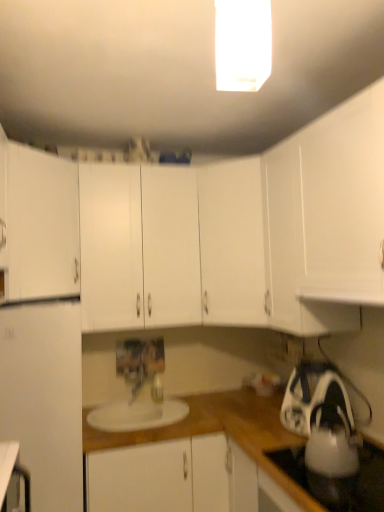
Question: From a real-world perspective, is white matte cabinet at center, the second cabinetry positioned from the bottom, beneath white glossy rectangular light fixture at upper center?

Choices:
 (A) yes
 (B) no

Answer: (A)

Question: From the image's perspective, is white matte cabinet at center, the third cabinetry viewed from the top, under white glossy rectangular light fixture at upper center?

Choices:
 (A) yes
 (B) no

Answer: (A)

Question: Can you confirm if white matte cabinet at center, the third cabinetry viewed from the top, is thinner than white glossy rectangular light fixture at upper center?

Choices:
 (A) no
 (B) yes

Answer: (A)

Question: Is white matte cabinet at center, the second cabinetry positioned from the bottom, positioned with its back to white glossy rectangular light fixture at upper center?

Choices:
 (A) yes
 (B) no

Answer: (B)

Question: Is the surface of white matte cabinet at center, the second cabinetry positioned from the bottom, in direct contact with white glossy rectangular light fixture at upper center?

Choices:
 (A) no
 (B) yes

Answer: (A)

Question: From a real-world perspective, is white glossy tea pot at lower right physically located above or below white matte iron at lower right?

Choices:
 (A) above
 (B) below

Answer: (B)

Question: Relative to white matte iron at lower right, is white glossy tea pot at lower right in front or behind?

Choices:
 (A) front
 (B) behind

Answer: (A)

Question: Considering the positions of white glossy tea pot at lower right and white matte iron at lower right in the image, is white glossy tea pot at lower right taller or shorter than white matte iron at lower right?

Choices:
 (A) tall
 (B) short

Answer: (B)

Question: Is point (314, 428) closer or farther from the camera than point (283, 411)?

Choices:
 (A) farther
 (B) closer

Answer: (B)

Question: In the image, is white matte cabinet at center, the second cabinetry positioned from the bottom, on the left side or the right side of white matte cabinet at center, the fourth cabinetry positioned from the top?

Choices:
 (A) left
 (B) right

Answer: (A)

Question: Based on their sizes in the image, would you say white matte cabinet at center, the third cabinetry viewed from the top, is bigger or smaller than white matte cabinet at center, the fourth cabinetry positioned from the top?

Choices:
 (A) small
 (B) big

Answer: (A)

Question: From the image's perspective, is white matte cabinet at center, the second cabinetry positioned from the bottom, above or below white matte cabinet at center, which ranks as the first cabinetry in bottom-to-top order?

Choices:
 (A) above
 (B) below

Answer: (A)

Question: Considering the positions of white matte cabinet at center, the second cabinetry positioned from the bottom, and white matte cabinet at center, the fourth cabinetry positioned from the top, in the image, is white matte cabinet at center, the second cabinetry positioned from the bottom, wider or thinner than white matte cabinet at center, the fourth cabinetry positioned from the top,?

Choices:
 (A) wide
 (B) thin

Answer: (B)

Question: Is white matte cabinet at center, the 3th cabinetry in the bottom-to-top sequence, situated inside white matte cabinet at left, placed as the fourth cabinetry when sorted from bottom to top, or outside?

Choices:
 (A) inside
 (B) outside

Answer: (B)

Question: Does point (264, 265) appear closer or farther from the camera than point (69, 238)?

Choices:
 (A) farther
 (B) closer

Answer: (B)